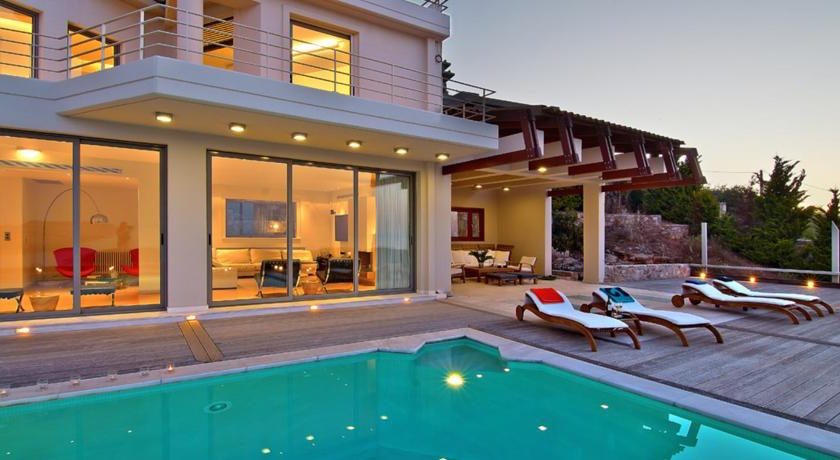
Where is `light`? light is located at coordinates (454, 381).